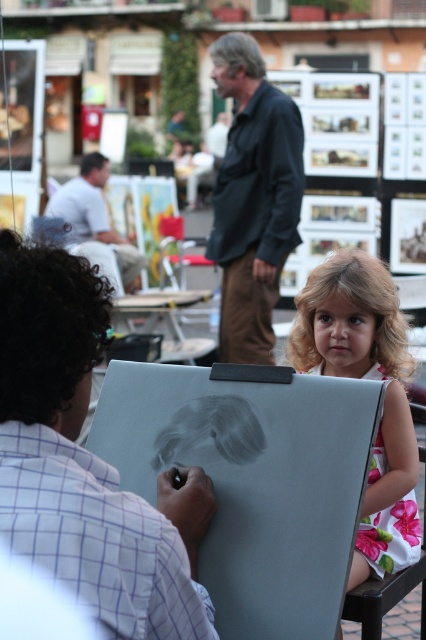
Can you confirm if matte white dress at lower right is shorter than floral fabric chair at lower right?

Correct, matte white dress at lower right is not as tall as floral fabric chair at lower right.

Is the position of matte white dress at lower right more distant than that of floral fabric chair at lower right?

That is False.

What do you see at coordinates (86, 460) in the screenshot?
I see `matte white dress at lower right` at bounding box center [86, 460].

You are a GUI agent. You are given a task and a screenshot of the screen. Output one action in this format:
    pyautogui.click(x=<x>, y=<y>)
    Task: Click on the matte white dress at lower right
    The height and width of the screenshot is (640, 426).
    Given the screenshot: What is the action you would take?
    pyautogui.click(x=86, y=460)

Can you confirm if floral cotton dress at right is wider than floral fabric chair at lower right?

Yes.

Is point (394, 406) closer to viewer compared to point (377, 600)?

That is False.

Which is in front, point (394, 356) or point (402, 580)?

Positioned in front is point (402, 580).

At what (x,y) coordinates should I click in order to perform the action: click on floral cotton dress at right. Please return your answer as a coordinate pair (x, y). This screenshot has height=640, width=426. Looking at the image, I should click on (365, 378).

Does dark gray shirt at center have a greater width compared to floral fabric chair at lower right?

Correct, the width of dark gray shirt at center exceeds that of floral fabric chair at lower right.

Which is in front, point (241, 273) or point (420, 556)?

Point (420, 556) is more forward.

Image resolution: width=426 pixels, height=640 pixels. Find the location of `dark gray shirt at center`. dark gray shirt at center is located at coordinates (253, 198).